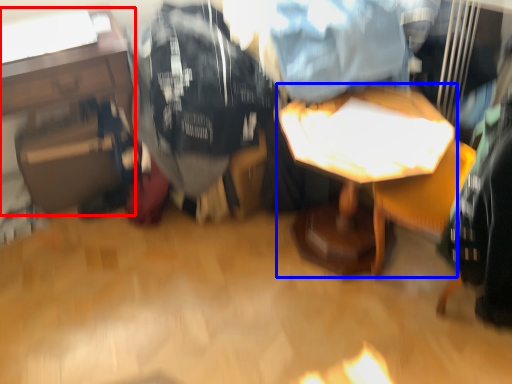
Question: Which object is further to the camera taking this photo, table (highlighted by a red box) or table (highlighted by a blue box)?

Choices:
 (A) table
 (B) table

Answer: (A)